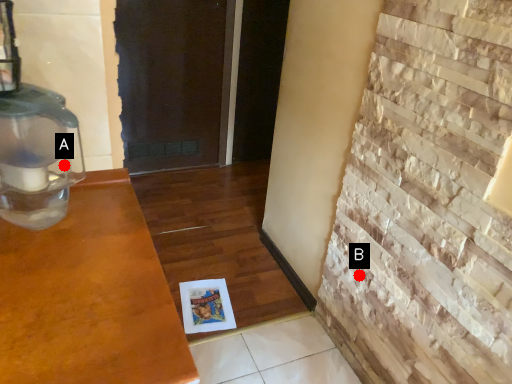
Question: Two points are circled on the image, labeled by A and B beside each circle. Which point is farther from the camera taking this photo?

Choices:
 (A) A is further
 (B) B is further

Answer: (B)